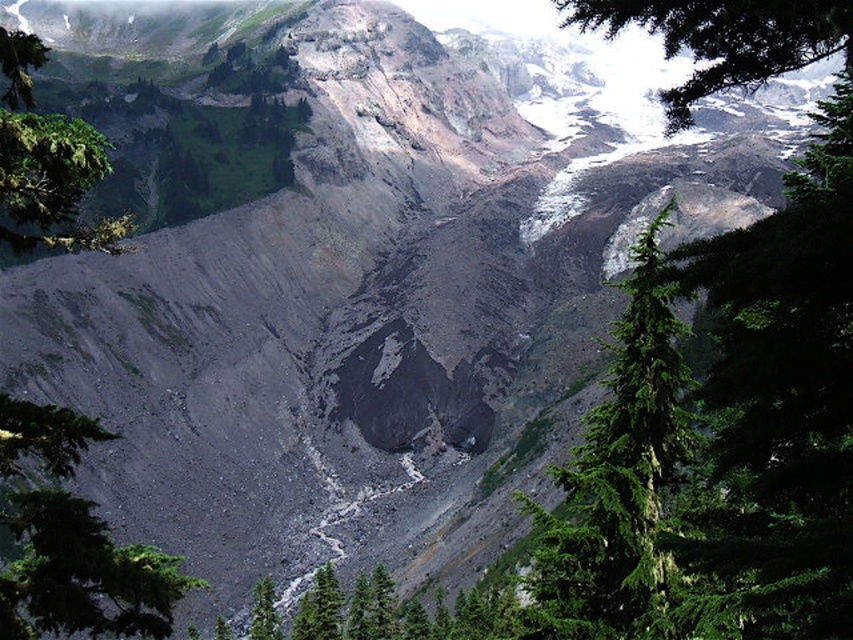
Can you confirm if green textured tree at center is positioned to the left of green leafy tree at upper left?

No, green textured tree at center is not to the left of green leafy tree at upper left.

The height and width of the screenshot is (640, 853). What do you see at coordinates (619, 483) in the screenshot? I see `green textured tree at center` at bounding box center [619, 483].

The image size is (853, 640). Identify the location of green textured tree at center. (619, 483).

Between green textured tree at lower left and green textured pine tree at upper right, which one is positioned lower?

Positioned lower is green textured tree at lower left.

The image size is (853, 640). What do you see at coordinates (73, 541) in the screenshot? I see `green textured tree at lower left` at bounding box center [73, 541].

Locate an element on the screen. This screenshot has height=640, width=853. green textured tree at lower left is located at coordinates (73, 541).

I want to click on green textured tree at lower left, so click(x=73, y=541).

Consider the image. Is green textured pine tree at upper right to the left of green leafy tree at upper left from the viewer's perspective?

Incorrect, green textured pine tree at upper right is not on the left side of green leafy tree at upper left.

Is point (767, 33) in front of point (93, 234)?

That is True.

The height and width of the screenshot is (640, 853). What are the coordinates of `green textured pine tree at upper right` in the screenshot? It's located at (724, 38).